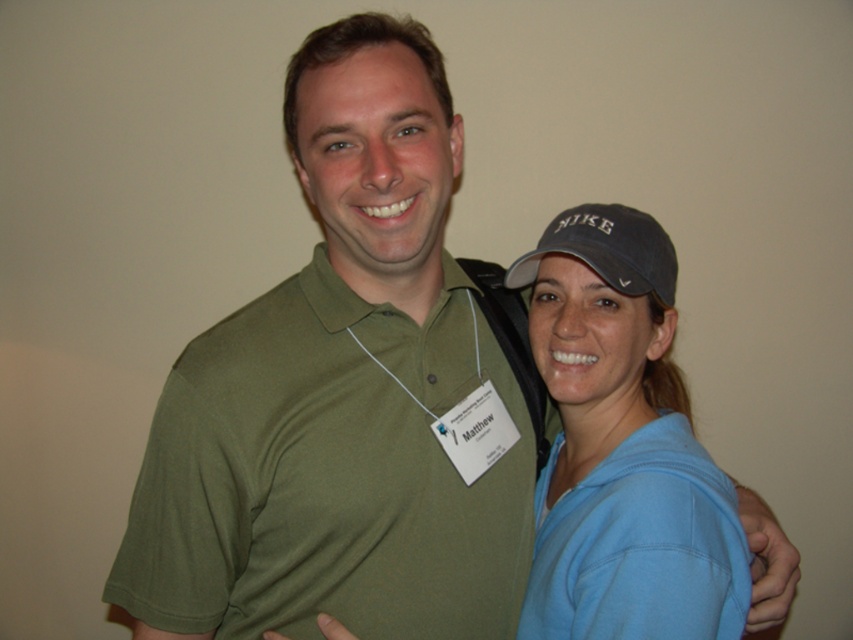
Question: Is blue cotton shirt at right smaller than dark gray fabric baseball cap at upper right?

Choices:
 (A) no
 (B) yes

Answer: (A)

Question: Among these objects, which one is farthest from the camera?

Choices:
 (A) blue cotton polo shirt at right
 (B) dark gray fabric baseball cap at upper right

Answer: (B)

Question: Does blue cotton shirt at right have a greater width compared to dark gray fabric baseball cap at upper right?

Choices:
 (A) yes
 (B) no

Answer: (A)

Question: Which object is farther from the camera taking this photo?

Choices:
 (A) olive green jersey at center
 (B) dark gray fabric baseball cap at upper right
 (C) blue cotton shirt at right

Answer: (A)

Question: In this image, where is olive green jersey at center located relative to blue cotton polo shirt at right?

Choices:
 (A) below
 (B) above

Answer: (B)

Question: Which of the following is the closest to the observer?

Choices:
 (A) (648, 557)
 (B) (517, 451)
 (C) (578, 460)

Answer: (A)